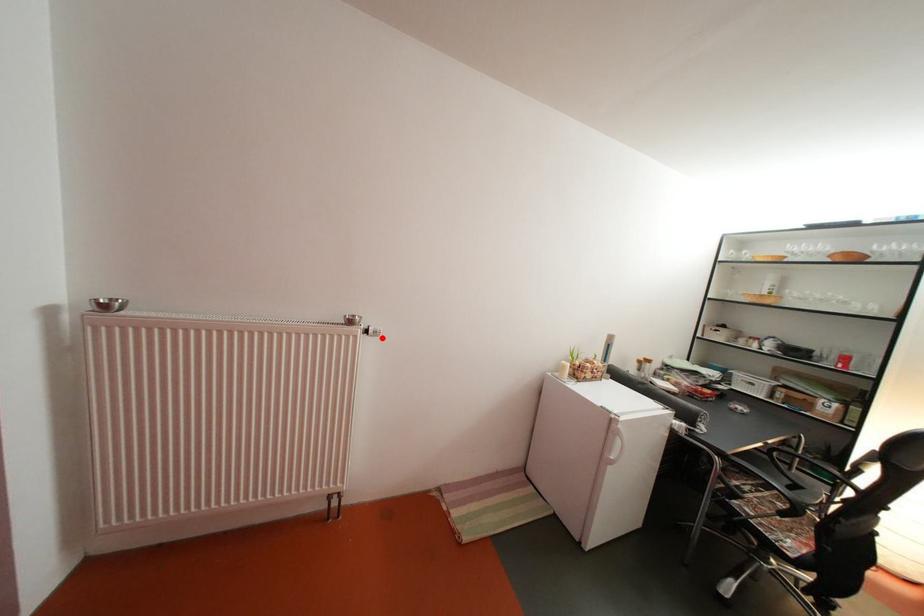
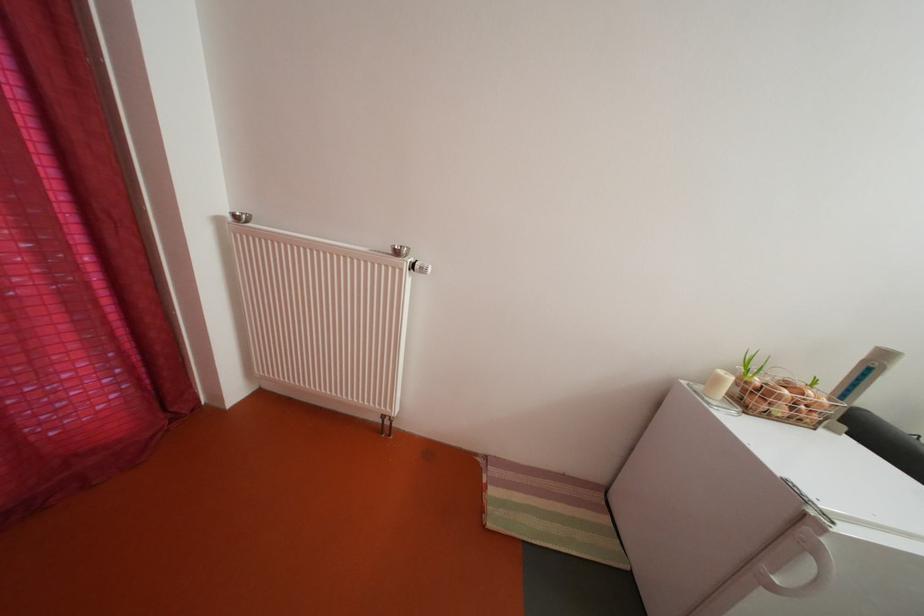
Question: I am providing you with two images of the same scene from different viewpoints. A red point is marked on the first image. Can you still see the location of the red point in image 2?

Choices:
 (A) Yes
 (B) No

Answer: (A)